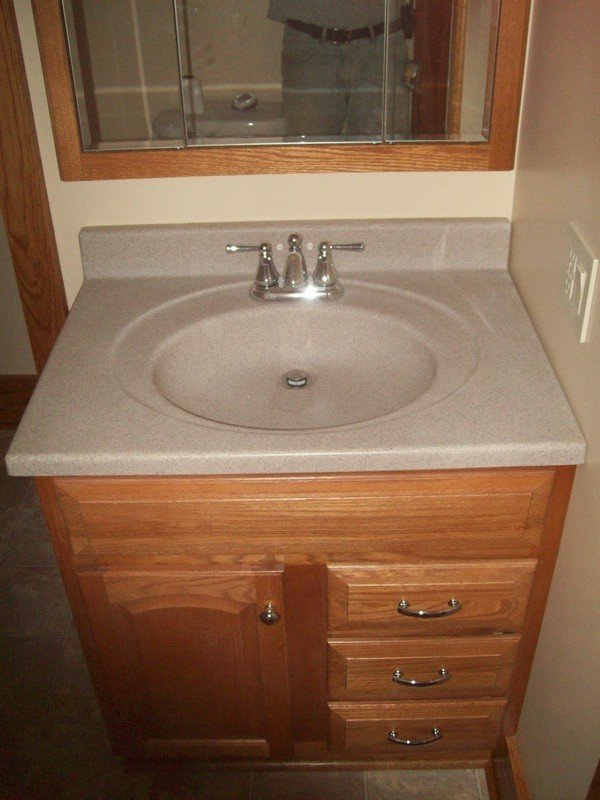
Find the location of `mirror`. mirror is located at coordinates (220, 84).